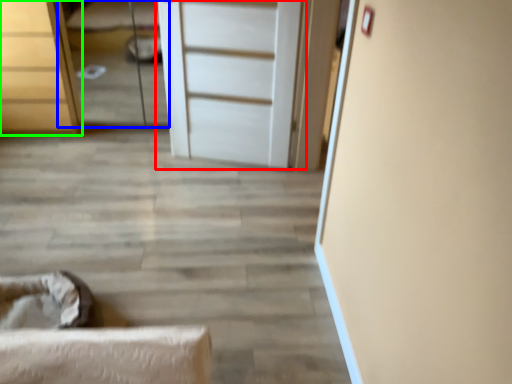
Question: Considering the real-world distances, which object is farthest from door (highlighted by a red box)? bed (highlighted by a blue box) or chest of drawers (highlighted by a green box)?

Choices:
 (A) bed
 (B) chest of drawers

Answer: (A)